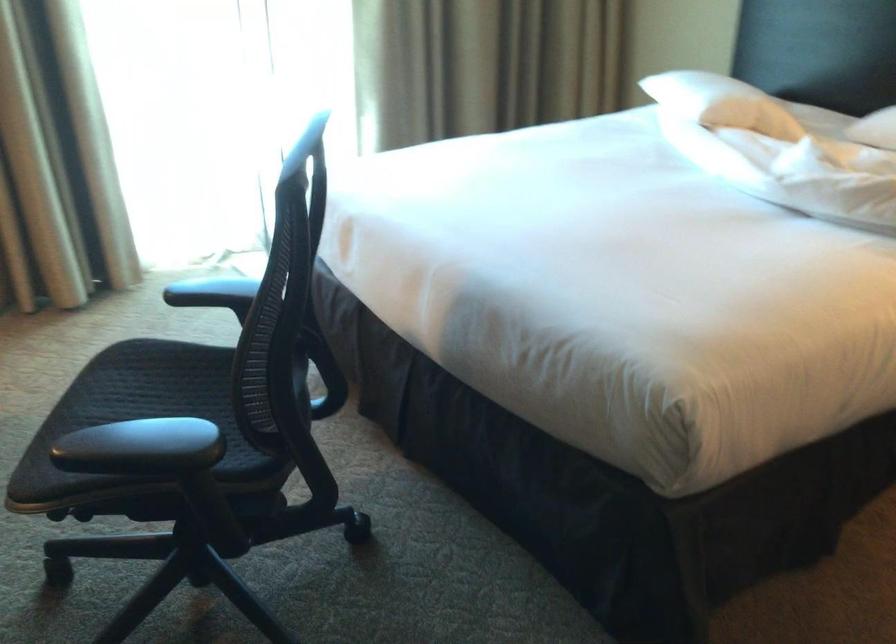
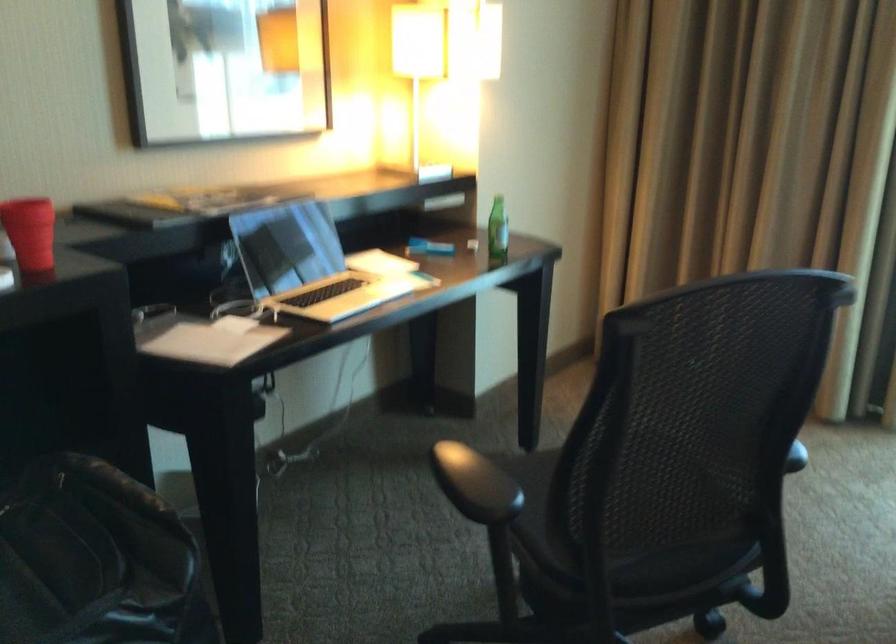
In the second image, find the point that corresponds to [234,386] in the first image.

(558, 480)